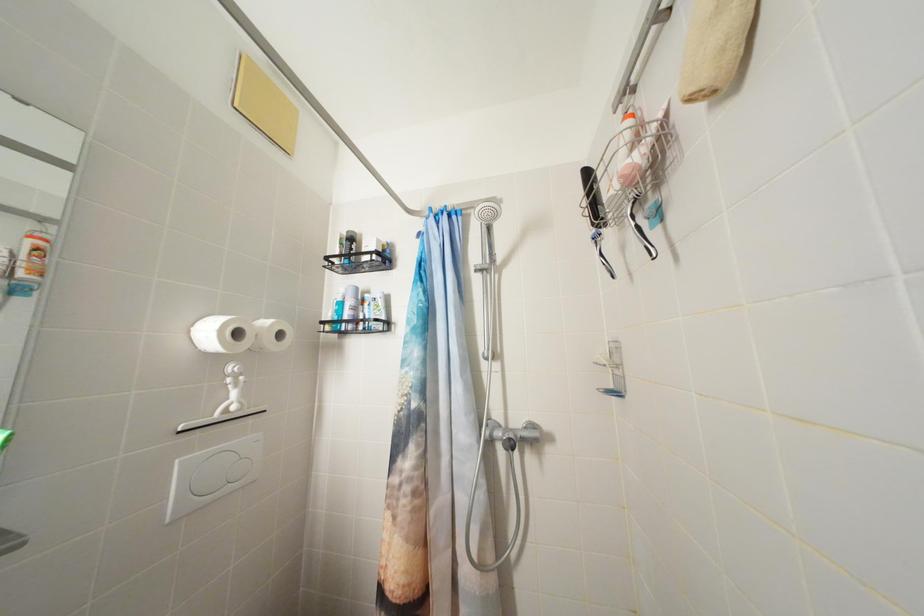
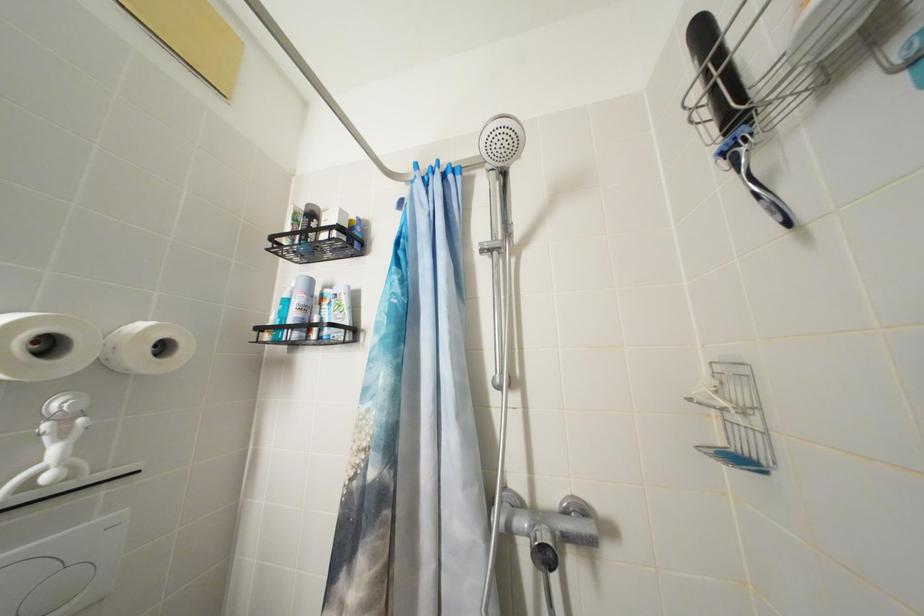
Question: In a continuous first-person perspective shot, in which direction is the camera moving?

Choices:
 (A) Left
 (B) Right
 (C) Forward
 (D) Backward

Answer: (C)